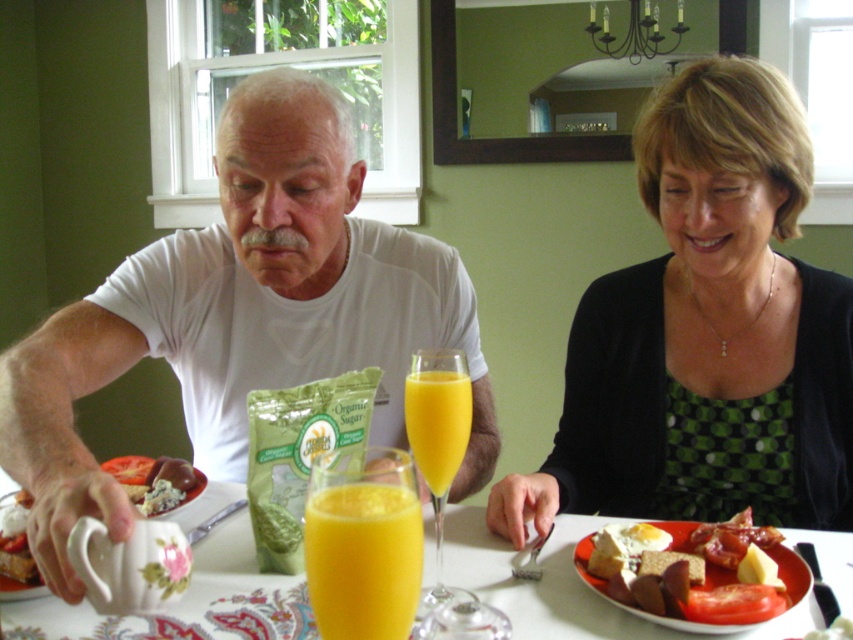
Looking at this image, you are setting the table for a family breakfast. You need to place a new bowl between the porcelain plate at center and the matte white creamer at lower left. Based on their positions, where should you place the bowl so it is directly in between them?

The porcelain plate at center is below the matte white creamer at lower left, so placing the bowl directly in between them would mean positioning it halfway between the two objects vertically.